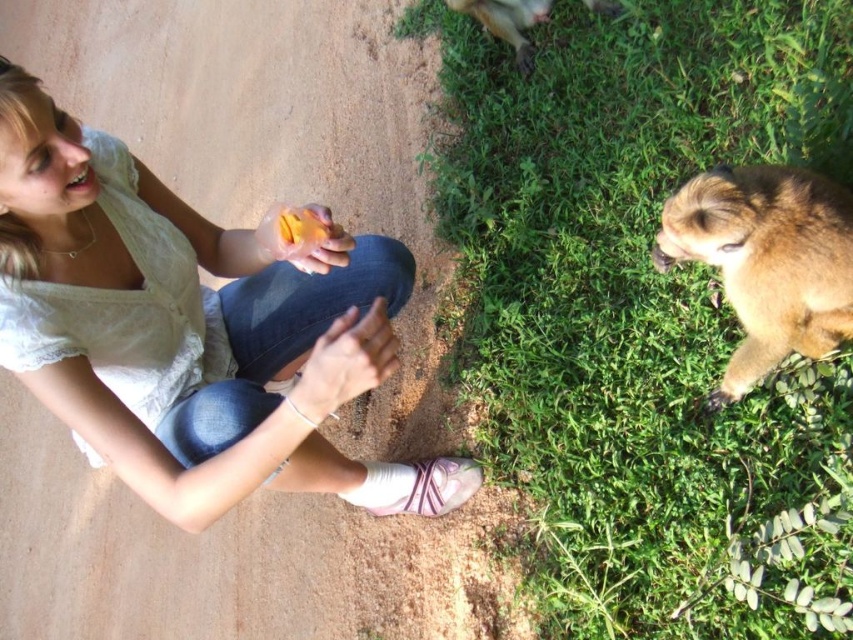
You are a photographer trying to capture a closeup shot of the brown furry dog at lower right and the brown furry monkey at upper right. Which animal should you zoom in on first to ensure both are in focus?

The brown furry dog at lower right is larger in size compared to the brown furry monkey at upper right, so you should zoom in on the brown furry dog at lower right first to ensure both are in focus.

You are standing in the scene and want to throw a ball to the brown furry dog at lower right. Based on its position, which direction should you aim relative to your current position?

The brown furry dog at lower right is located at point (767, 260), so you should aim towards the lower right direction relative to your current position.

You are a photographer trying to capture a closeup shot of the white lace shirt at upper left and the brown furry monkey at upper right. Based on their sizes, which one should you zoom in on more to ensure both are equally visible in the frame?

Answer: The white lace shirt at upper left is larger than the brown furry monkey at upper right, so you should zoom in more on the brown furry monkey at upper right to balance their sizes in the photo.